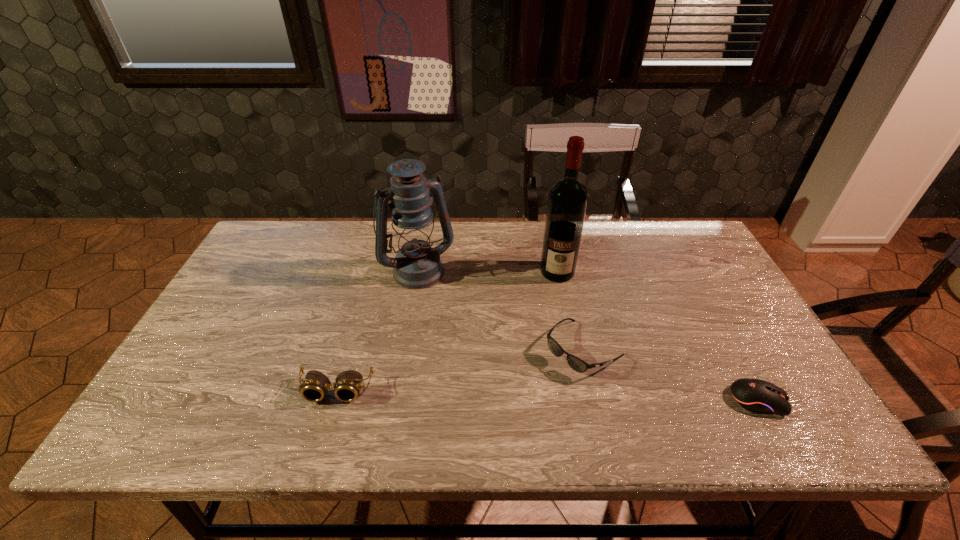
Find the location of a particular element. The height and width of the screenshot is (540, 960). goggles is located at coordinates (315, 387).

Where is `computer mouse`? The height and width of the screenshot is (540, 960). computer mouse is located at coordinates (758, 396).

At what (x,y) coordinates should I click in order to perform the action: click on the shortest object. Please return your answer as a coordinate pair (x, y). The image size is (960, 540). Looking at the image, I should click on (758, 396).

Image resolution: width=960 pixels, height=540 pixels. What are the coordinates of `the second tallest object` in the screenshot? It's located at (417, 265).

In order to click on sunglasses in this screenshot , I will do `click(575, 363)`.

Identify the location of alcohol. (567, 201).

Identify the location of free space located on the left of the rightmost object. This screenshot has height=540, width=960. (571, 400).

In order to click on vacant region located 0.090m on the front-facing side of the lantern in this screenshot , I will do `click(443, 307)`.

Find the location of a particular element. free space located 0.170m on the front-facing side of the lantern is located at coordinates (454, 327).

This screenshot has height=540, width=960. In order to click on vacant space situated on the front-facing side of the lantern in this screenshot , I will do `click(444, 309)`.